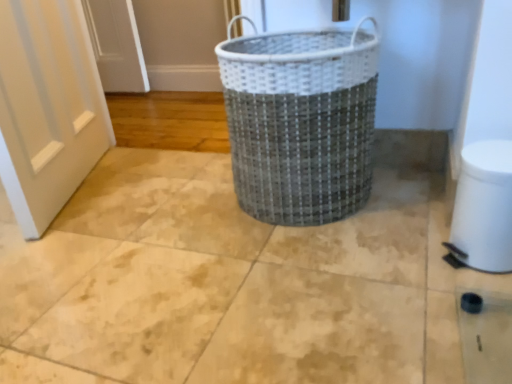
Find the location of `space that is in front of metallic woven basket at center`. space that is in front of metallic woven basket at center is located at coordinates (311, 278).